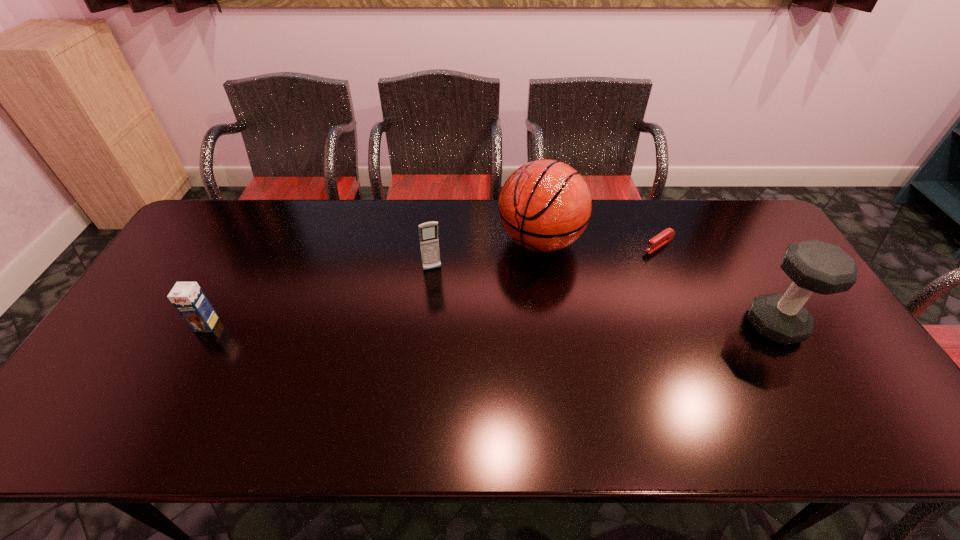
At what (x,y) coordinates should I click in order to perform the action: click on free spot located on the side with spill of the third object from right to left. Please return your answer as a coordinate pair (x, y). This screenshot has height=540, width=960. Looking at the image, I should click on (502, 272).

At what (x,y) coordinates should I click in order to perform the action: click on free space located on the side with spill of the third object from right to left. Please return your answer as a coordinate pair (x, y). This screenshot has width=960, height=540. Looking at the image, I should click on (487, 285).

Locate an element on the screen. vacant space located 0.220m on the side with spill of the third object from right to left is located at coordinates (464, 303).

Where is `vacant space situated 0.110m on the front-facing side of the stapler`? The image size is (960, 540). vacant space situated 0.110m on the front-facing side of the stapler is located at coordinates (625, 266).

Image resolution: width=960 pixels, height=540 pixels. I want to click on free location located 0.130m on the front-facing side of the stapler, so [x=621, y=268].

Identify the location of free spot located 0.080m on the front-facing side of the stapler. This screenshot has height=540, width=960. (632, 261).

The width and height of the screenshot is (960, 540). Identify the location of vacant space situated on the front-facing side of the third tallest object. (453, 329).

I want to click on vacant area situated on the front-facing side of the third tallest object, so click(465, 366).

Where is `vacant space located 0.380m on the front-facing side of the third tallest object`? The image size is (960, 540). vacant space located 0.380m on the front-facing side of the third tallest object is located at coordinates (469, 379).

Identify the location of basketball present at the far edge. This screenshot has height=540, width=960. (545, 205).